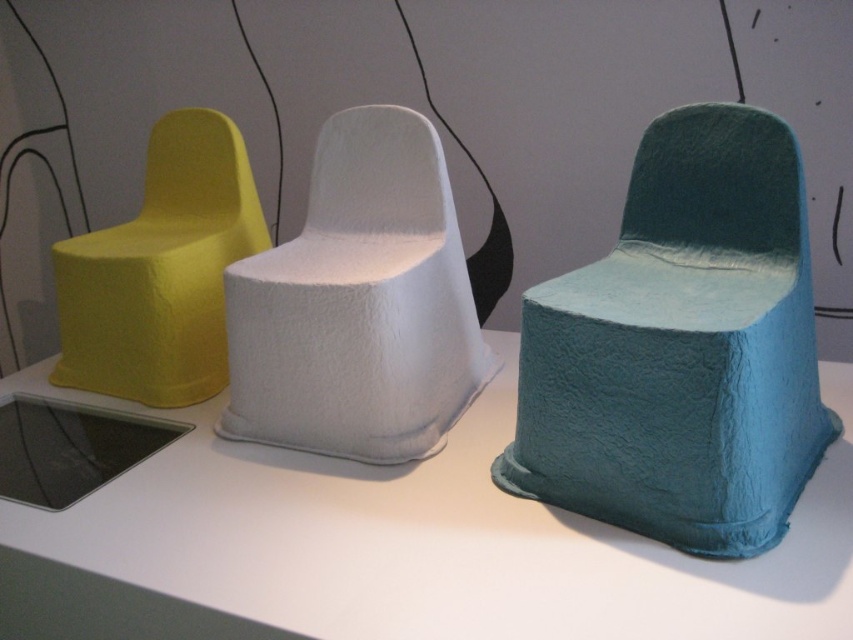
You are an interior designer arranging furniture for a client who wants to place a new teal armchair between the white felt armchair at center and the matte yellow armchair at left. Based on their current positions, where should the teal armchair be placed?

The white felt armchair at center is to the right of the matte yellow armchair at left. To place the teal armchair between them, it should be positioned between the white felt armchair at center and the matte yellow armchair at left, maintaining their existing spatial relationship.

From the picture: You are an interior designer assessing the placement of two points in the image. Which point, point (x=651, y=154) or point (x=83, y=305), is positioned closer to the viewer?

Point (x=651, y=154) is closer to the viewer than point (x=83, y=305).

You are an interior designer planning to place a new lamp between the two points, point (264, 308) and point (167, 298). Which point should the lamp be closer to if you want it to appear closer to the viewer?

The lamp should be placed closer to point (264, 308) because it is closer to the viewer than point (167, 298).